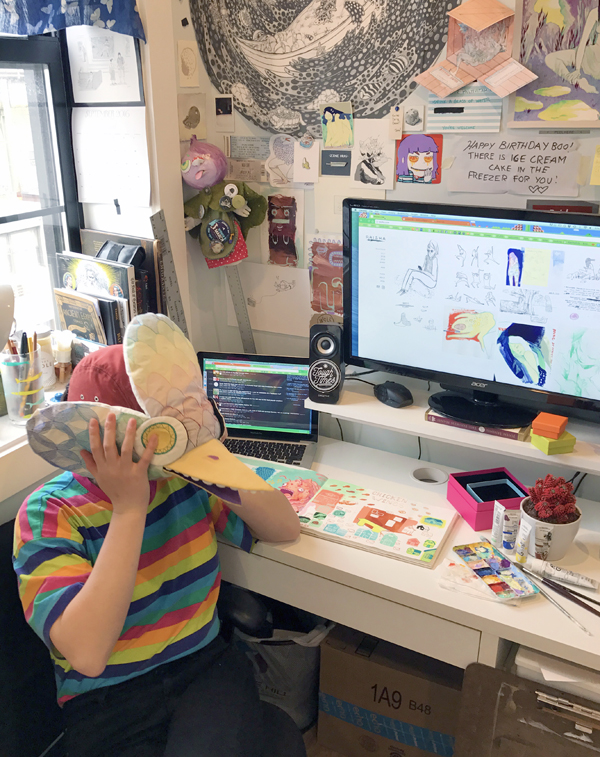
You are a GUI agent. You are given a task and a screenshot of the screen. Output one action in this format:
    pyautogui.click(x=<x>, y=<y>)
    Task: Click on the speaker
    
    Given the screenshot: What is the action you would take?
    pyautogui.click(x=331, y=346)